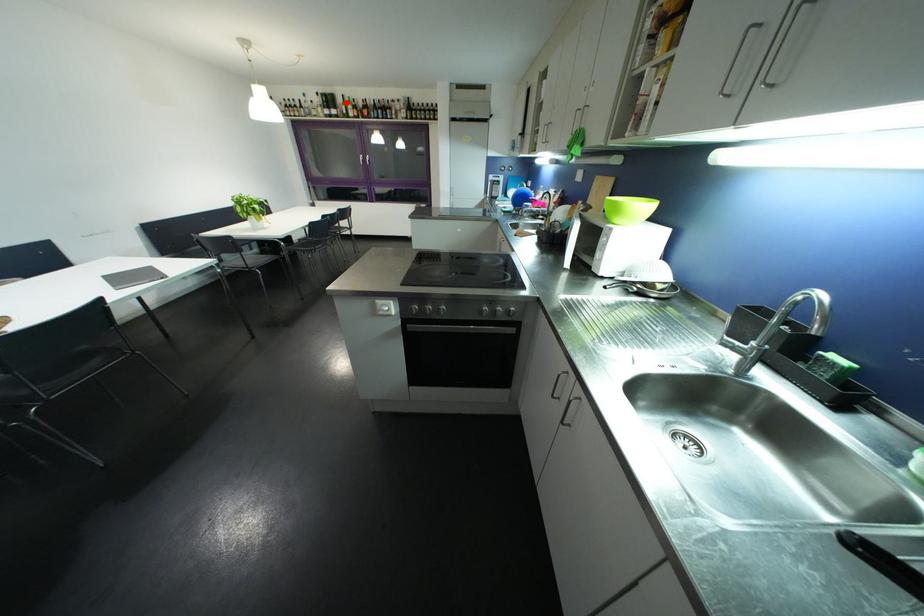
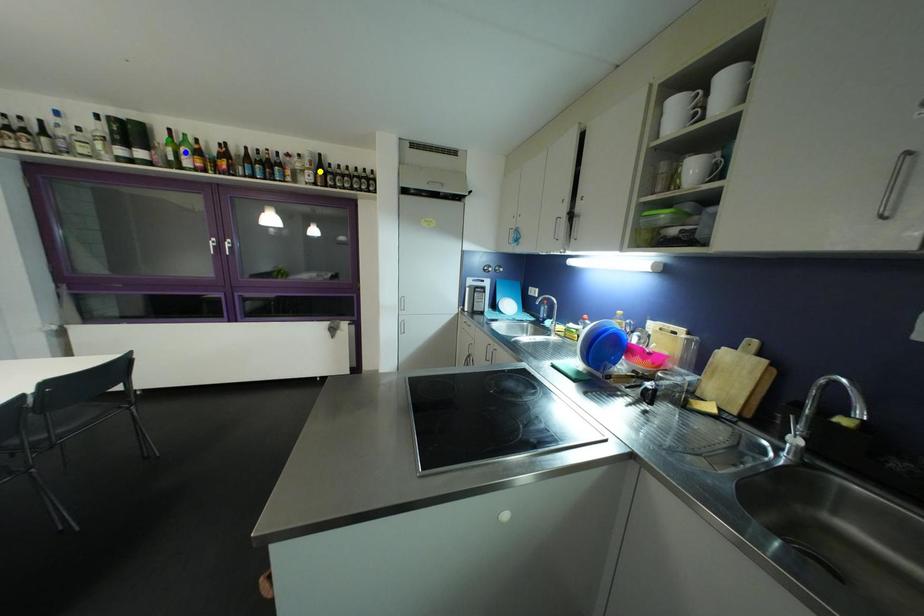
Question: I am providing you with two images of the same scene from different viewpoints. A red point is marked on the first image. You are given multiple points on the second image. In image 2, which mark is for the same physical point as the one in image 1?

Choices:
 (A) green point
 (B) yellow point
 (C) blue point

Answer: (A)